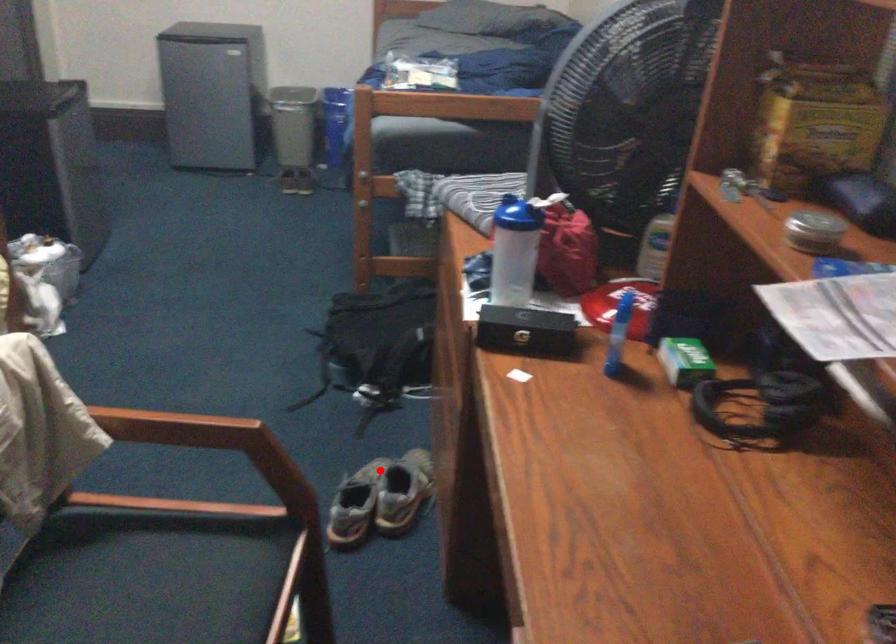
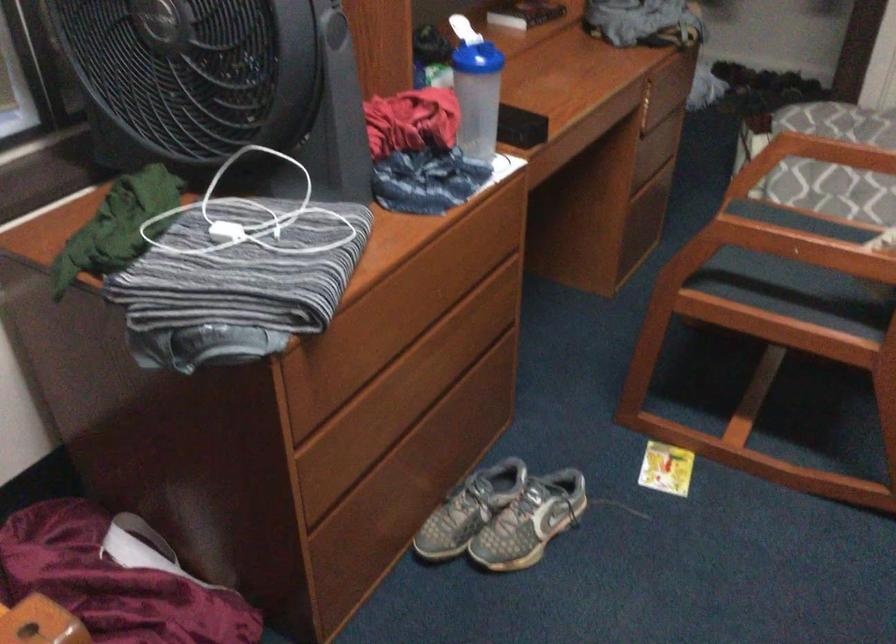
Locate, in the second image, the point that corresponds to the highlighted location in the first image.

(503, 516)